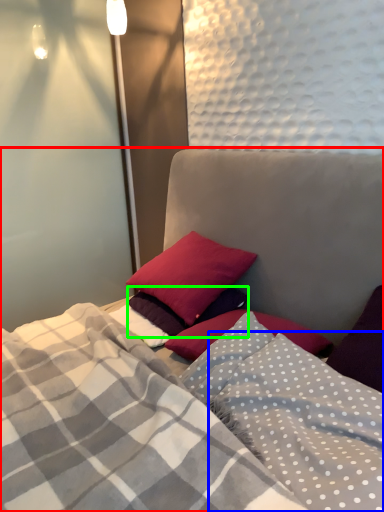
Question: Considering the real-world distances, which object is farthest from bed (highlighted by a red box)? blanket (highlighted by a blue box) or pillow (highlighted by a green box)?

Choices:
 (A) blanket
 (B) pillow

Answer: (B)